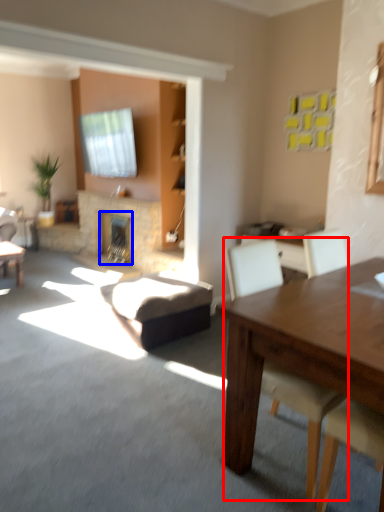
Question: Which point is closer to the camera, chair (highlighted by a red box) or fireplace (highlighted by a blue box)?

Choices:
 (A) chair
 (B) fireplace

Answer: (A)